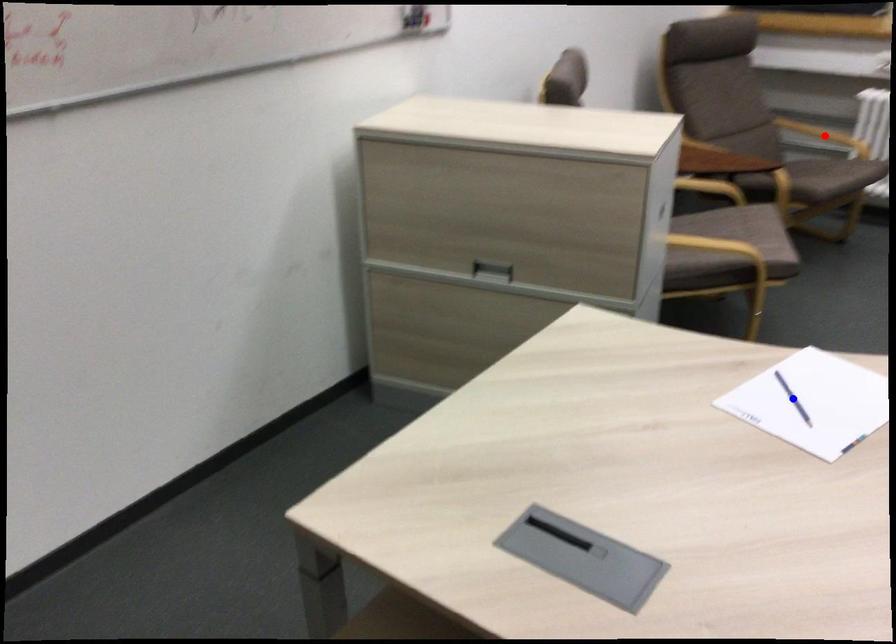
Question: Two points are marked on the image. Which point is closer to the camera?

Choices:
 (A) Blue point is closer.
 (B) Red point is closer.

Answer: (A)